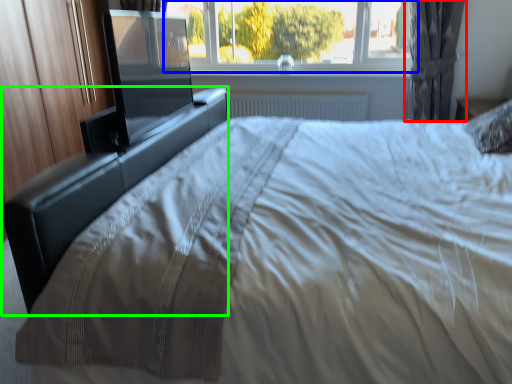
Question: Which is farther away from curtain (highlighted by a red box)? window (highlighted by a blue box) or bed frame (highlighted by a green box)?

Choices:
 (A) window
 (B) bed frame

Answer: (B)